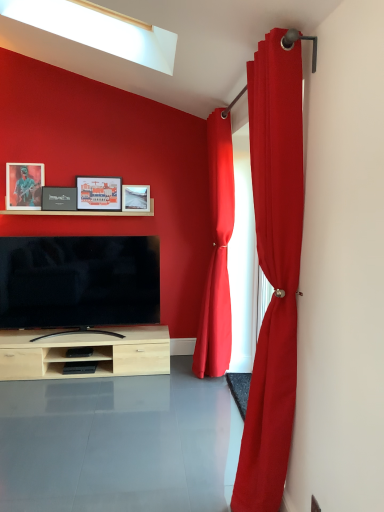
Question: Looking at their shapes, would you say matte red curtain at right, which is the first curtain in back-to-front order, is wider or thinner than matte black picture frame at upper left, which appears as the first picture frame when viewed from the left?

Choices:
 (A) wide
 (B) thin

Answer: (A)

Question: From a real-world perspective, relative to matte black picture frame at upper left, positioned as the fourth picture frame in right-to-left order, is matte red curtain at right, which is the second curtain in front-to-back order, vertically above or below?

Choices:
 (A) below
 (B) above

Answer: (A)

Question: Which object is the closest to the matte wooden picture frame at center, the first picture frame positioned from the right?

Choices:
 (A) matte red curtain at right, which is the first curtain in back-to-front order
 (B) matte red curtain at right, the 2th curtain viewed from the back
 (C) matte black tv at center
 (D) matte black picture frame at center, which appears as the second picture frame when viewed from the left
 (E) matte paper picture frame at upper center, which is counted as the third picture frame, starting from the left

Answer: (E)

Question: Which is farther from the matte wooden picture frame at center, which is counted as the 4th picture frame, starting from the left?

Choices:
 (A) matte black picture frame at upper left, positioned as the fourth picture frame in right-to-left order
 (B) matte black picture frame at center, which is counted as the third picture frame, starting from the right
 (C) matte red curtain at right, which is the first curtain in back-to-front order
 (D) matte black tv at center
 (E) wooden shelf at upper center

Answer: (C)